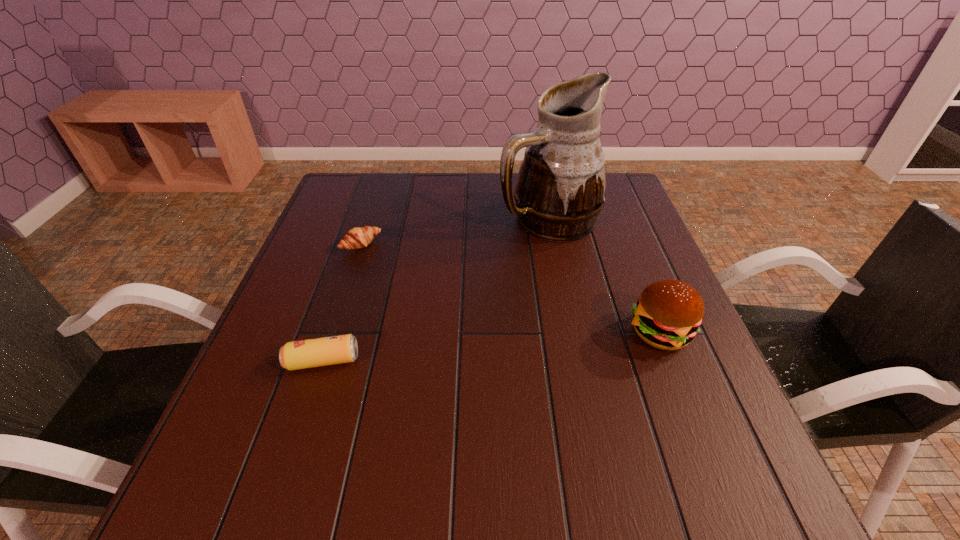
I want to click on free space on the desktop that is between the beer can and the third shortest object and is positioned from the spout of the tallest object, so click(x=489, y=347).

Where is `vacant space on the desktop that is between the beer can and the hamburger and is positioned on the front-facing side of the shortest object`? This screenshot has width=960, height=540. vacant space on the desktop that is between the beer can and the hamburger and is positioned on the front-facing side of the shortest object is located at coordinates (477, 348).